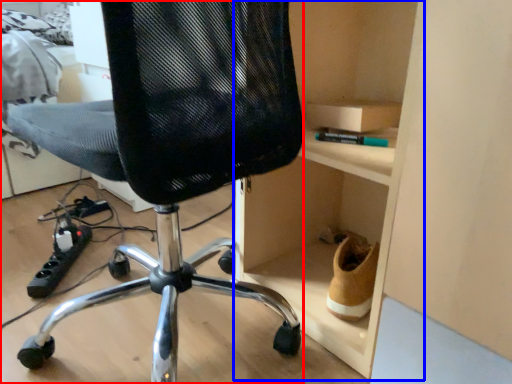
Question: Which object appears closest to the camera in this image, chair (highlighted by a red box) or cabinet (highlighted by a blue box)?

Choices:
 (A) chair
 (B) cabinet

Answer: (A)